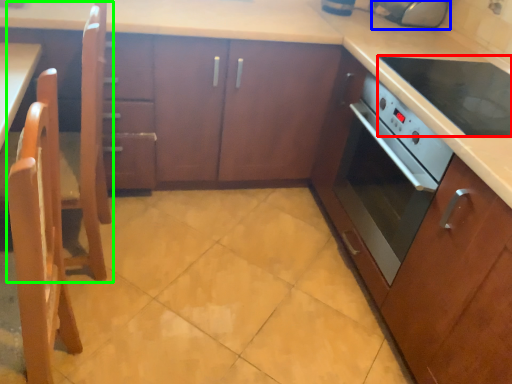
Question: Based on their relative distances, which object is farther from kitchen appliance (highlighted by a red box)? Choose from appliance (highlighted by a blue box) and chair (highlighted by a green box).

Choices:
 (A) appliance
 (B) chair

Answer: (B)